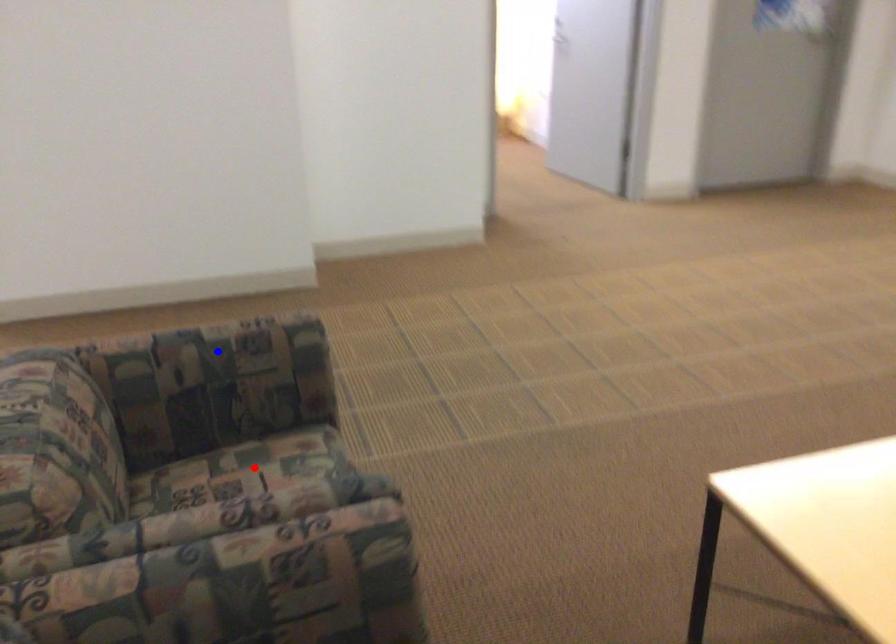
Question: In the image, two points are highlighted. Which point is nearer to the camera? Reply with the corresponding letter.

Choices:
 (A) blue point
 (B) red point

Answer: (B)